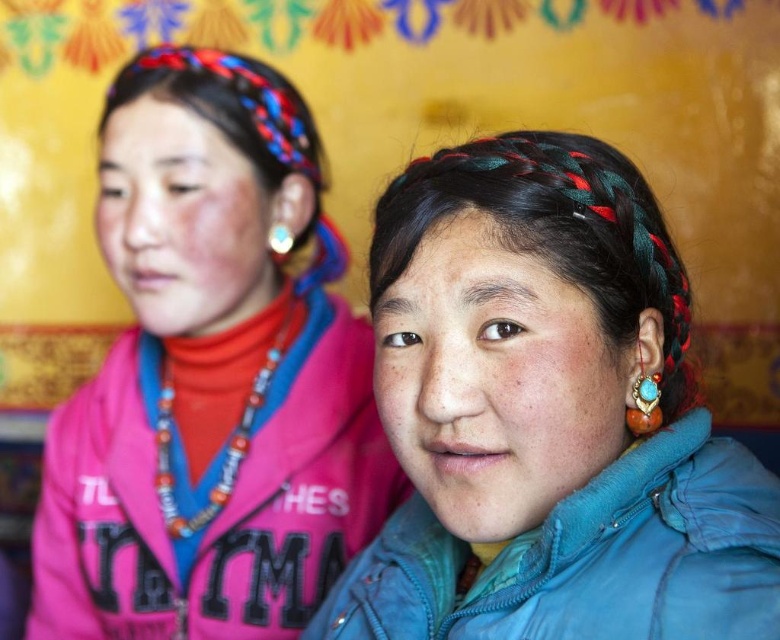
Between matte pink jacket at left and blue leather jacket at lower right, which one has more height?

With more height is matte pink jacket at left.

Between point (285, 371) and point (665, 435), which one is positioned behind?

Point (285, 371)

The width and height of the screenshot is (780, 640). Identify the location of matte pink jacket at left. (211, 376).

Is point (491, 632) more distant than point (275, 337)?

No, (491, 632) is in front of (275, 337).

Between point (392, 544) and point (186, 520), which one is positioned in front?

Point (392, 544)

In order to click on blue leather jacket at lower right in this screenshot , I will do `click(587, 557)`.

What are the coordinates of `blue leather jacket at lower right` in the screenshot? It's located at click(587, 557).

Does blue leather jacket at center have a larger size compared to turquoise stone ring at ear?

Yes.

Who is higher up, blue leather jacket at center or turquoise stone ring at ear?

turquoise stone ring at ear

This screenshot has width=780, height=640. Identify the location of blue leather jacket at center. (546, 416).

You are a GUI agent. You are given a task and a screenshot of the screen. Output one action in this format:
    pyautogui.click(x=<x>, y=<y>)
    Task: Click on the blue leather jacket at center
    Image resolution: width=780 pixels, height=640 pixels.
    Given the screenshot: What is the action you would take?
    point(546,416)